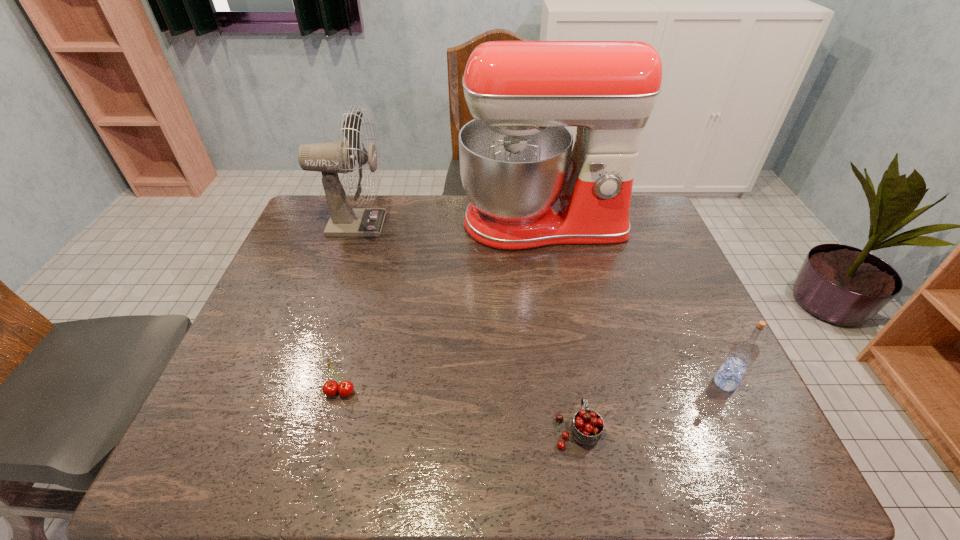
Locate an element on the screen. the tallest object is located at coordinates 528,188.

Where is `the fourth shortest object`? This screenshot has height=540, width=960. the fourth shortest object is located at coordinates (331, 158).

Locate an element on the screen. The width and height of the screenshot is (960, 540). the rightmost object is located at coordinates (743, 353).

Identify the location of vodka. This screenshot has width=960, height=540. (743, 353).

Locate an element on the screen. the nearest object is located at coordinates (587, 426).

The height and width of the screenshot is (540, 960). Find the location of `the nearer cherry`. the nearer cherry is located at coordinates pos(587,426).

Locate an element on the screen. Image resolution: width=960 pixels, height=540 pixels. the farther cherry is located at coordinates (330, 388).

I want to click on free space located 0.150m on the front-facing side of the tallest object, so click(555, 291).

You are a GUI agent. You are given a task and a screenshot of the screen. Output one action in this format:
    pyautogui.click(x=<x>, y=<y>)
    Task: Click on the vacant area situated on the air flow direction of the fan
    
    Given the screenshot: What is the action you would take?
    pyautogui.click(x=501, y=224)

Locate an element on the screen. This screenshot has height=540, width=960. vacant region located 0.360m on the back of the vodka is located at coordinates (670, 268).